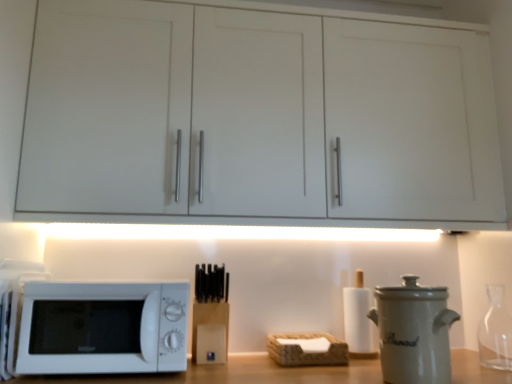
In order to click on white matte cabinet at upper center in this screenshot , I will do `click(13, 92)`.

What do you see at coordinates (13, 92) in the screenshot? This screenshot has width=512, height=384. I see `white matte cabinet at upper center` at bounding box center [13, 92].

Where is `brown woven basket at center`? This screenshot has height=384, width=512. brown woven basket at center is located at coordinates (304, 352).

Where is `white matte paper towel at center-right, acting as the second bottle starting from the right`? The height and width of the screenshot is (384, 512). white matte paper towel at center-right, acting as the second bottle starting from the right is located at coordinates (358, 319).

This screenshot has width=512, height=384. Describe the element at coordinates (103, 328) in the screenshot. I see `white matte microwave at lower left` at that location.

At what (x,y) coordinates should I click in order to perform the action: click on white matte cabinet at upper center. Please return your answer as a coordinate pair (x, y). The height and width of the screenshot is (384, 512). Looking at the image, I should click on (13, 92).

Is white matte paper towel at center-right, the second bottle in the front-to-back sequence, with brown woven basket at center?

No, white matte paper towel at center-right, the second bottle in the front-to-back sequence, is not making contact with brown woven basket at center.

Considering the relative positions of white matte paper towel at center-right, acting as the first bottle starting from the left, and brown woven basket at center in the image provided, is white matte paper towel at center-right, acting as the first bottle starting from the left, to the left or to the right of brown woven basket at center?

Clearly, white matte paper towel at center-right, acting as the first bottle starting from the left, is on the right of brown woven basket at center in the image.

Considering the sizes of objects white matte paper towel at center-right, acting as the first bottle starting from the left, and brown woven basket at center in the image provided, who is taller, white matte paper towel at center-right, acting as the first bottle starting from the left, or brown woven basket at center?

white matte paper towel at center-right, acting as the first bottle starting from the left, is taller.

Can you tell me how much white matte paper towel at center-right, acting as the second bottle starting from the right, and brown woven basket at center differ in facing direction?

The angle between the facing direction of white matte paper towel at center-right, acting as the second bottle starting from the right, and the facing direction of brown woven basket at center is 0.000762 degrees.

Based on the photo, considering the relative sizes of white matte cabinet at upper center and white matte microwave at lower left in the image provided, is white matte cabinet at upper center taller than white matte microwave at lower left?

Correct, white matte cabinet at upper center is much taller as white matte microwave at lower left.

From a real-world perspective, who is located higher, white matte cabinet at upper center or white matte microwave at lower left?

white matte cabinet at upper center is physically above.

The image size is (512, 384). I want to click on cabinetry above the white matte microwave at lower left (from a real-world perspective), so click(x=13, y=92).

Looking at this image, considering the sizes of objects white matte cabinet at upper center and white matte microwave at lower left in the image provided, who is thinner, white matte cabinet at upper center or white matte microwave at lower left?

Thinner between the two is white matte cabinet at upper center.

Is there a large distance between white matte cabinet at upper center and white ceramic bread bin at right?

Yes.

Is white matte cabinet at upper center aimed at white ceramic bread bin at right?

No, white matte cabinet at upper center is not oriented towards white ceramic bread bin at right.

From a real-world perspective, who is located higher, white matte cabinet at upper center or white ceramic bread bin at right?

white matte cabinet at upper center.

Considering the sizes of objects white matte cabinet at upper center and white ceramic bread bin at right in the image provided, who is taller, white matte cabinet at upper center or white ceramic bread bin at right?

Standing taller between the two is white matte cabinet at upper center.

From the image's perspective, is white matte paper towel at center-right, the second bottle in the front-to-back sequence, above or below white ceramic bread bin at right?

white matte paper towel at center-right, the second bottle in the front-to-back sequence, is situated lower than white ceramic bread bin at right in the image.

In the scene shown: Is white matte paper towel at center-right, positioned as the first bottle in back-to-front order, at the left side of white ceramic bread bin at right?

Yes, white matte paper towel at center-right, positioned as the first bottle in back-to-front order, is to the left of white ceramic bread bin at right.

Considering the points (356, 295) and (430, 341), which point is in front, point (356, 295) or point (430, 341)?

The point (430, 341) is in front.

Is white ceramic bread bin at right positioned before transparent glass bottle at right, placed as the 1th bottle when sorted from front to back?

Yes, white ceramic bread bin at right is closer to the camera.

Consider the image. From a real-world perspective, is white ceramic bread bin at right positioned over transparent glass bottle at right, which ranks as the 2th bottle in back-to-front order, based on gravity?

Actually, white ceramic bread bin at right is physically below transparent glass bottle at right, which ranks as the 2th bottle in back-to-front order, in the real world.

Which point is more distant from viewer, (447,332) or (492,364)?

Point (492,364)

Does white ceramic bread bin at right touch transparent glass bottle at right, placed as the 1th bottle when sorted from front to back?

No, white ceramic bread bin at right is not making contact with transparent glass bottle at right, placed as the 1th bottle when sorted from front to back.

Is point (362, 356) less distant than point (48, 359)?

No, (362, 356) is further to viewer.

Measure the distance between white matte paper towel at center-right, the second bottle in the front-to-back sequence, and white matte microwave at lower left.

white matte paper towel at center-right, the second bottle in the front-to-back sequence, and white matte microwave at lower left are 31.41 inches apart.

Which of these two, white matte paper towel at center-right, positioned as the first bottle in back-to-front order, or white matte microwave at lower left, is thinner?

white matte paper towel at center-right, positioned as the first bottle in back-to-front order.

Looking at this image, is white matte paper towel at center-right, the second bottle in the front-to-back sequence, not near white matte microwave at lower left?

No, white matte paper towel at center-right, the second bottle in the front-to-back sequence, is in close proximity to white matte microwave at lower left.

Image resolution: width=512 pixels, height=384 pixels. What are the coordinates of `bottle that is the 2nd object above the white matte microwave at lower left (from a real-world perspective)` in the screenshot? It's located at (495, 332).

Which of these two, transparent glass bottle at right, arranged as the second bottle when viewed from the left, or white matte microwave at lower left, stands shorter?

With less height is white matte microwave at lower left.

Is transparent glass bottle at right, acting as the 1th bottle starting from the right, far from white matte microwave at lower left?

Indeed, transparent glass bottle at right, acting as the 1th bottle starting from the right, is not near white matte microwave at lower left.

Between transparent glass bottle at right, which ranks as the 2th bottle in back-to-front order, and white matte microwave at lower left, which one is positioned behind?

transparent glass bottle at right, which ranks as the 2th bottle in back-to-front order.

From a real-world perspective, which bottle is the 1st one above the brown woven basket at center? Please provide its 2D coordinates.

[(358, 319)]

At what (x,y) coordinates should I click in order to perform the action: click on microwave oven below the white matte cabinet at upper center (from the image's perspective). Please return your answer as a coordinate pair (x, y). The image size is (512, 384). Looking at the image, I should click on pos(103,328).

Considering their positions, is transparent glass bottle at right, which ranks as the 2th bottle in back-to-front order, positioned further to white matte cabinet at upper center than brown woven basket at center?

transparent glass bottle at right, which ranks as the 2th bottle in back-to-front order, is further to white matte cabinet at upper center.

When comparing their distances from white matte microwave at lower left, does white matte paper towel at center-right, acting as the first bottle starting from the left, or white matte cabinet at upper center seem further?

Among the two, white matte paper towel at center-right, acting as the first bottle starting from the left, is located further to white matte microwave at lower left.

In the scene shown: When comparing their distances from transparent glass bottle at right, which ranks as the 2th bottle in back-to-front order, does white matte microwave at lower left or white matte cabinet at upper center seem further?

Based on the image, white matte cabinet at upper center appears to be further to transparent glass bottle at right, which ranks as the 2th bottle in back-to-front order.

When comparing their distances from white matte paper towel at center-right, positioned as the first bottle in back-to-front order, does white matte cabinet at upper center or brown woven basket at center seem closer?

brown woven basket at center lies closer to white matte paper towel at center-right, positioned as the first bottle in back-to-front order, than the other object.

Considering their positions, is brown woven basket at center positioned further to white matte paper towel at center-right, the second bottle in the front-to-back sequence, than white matte microwave at lower left?

white matte microwave at lower left.

Estimate the real-world distances between objects in this image. Which object is closer to white matte cabinet at upper center, white matte microwave at lower left or white matte paper towel at center-right, acting as the first bottle starting from the left?

Among the two, white matte microwave at lower left is located nearer to white matte cabinet at upper center.

Based on their spatial positions, is white matte microwave at lower left or white ceramic bread bin at right further from transparent glass bottle at right, acting as the 1th bottle starting from the right?

white matte microwave at lower left is positioned further to the anchor transparent glass bottle at right, acting as the 1th bottle starting from the right.

When comparing their distances from transparent glass bottle at right, acting as the 1th bottle starting from the right, does white matte paper towel at center-right, acting as the first bottle starting from the left, or brown woven basket at center seem further?

Based on the image, brown woven basket at center appears to be further to transparent glass bottle at right, acting as the 1th bottle starting from the right.

This screenshot has height=384, width=512. I want to click on basket between white matte microwave at lower left and transparent glass bottle at right, arranged as the second bottle when viewed from the left, from left to right, so pos(304,352).

Find the location of a particular element. The image size is (512, 384). cabinetry between white matte microwave at lower left and transparent glass bottle at right, placed as the 1th bottle when sorted from front to back is located at coordinates (13, 92).

I want to click on bottle between white matte microwave at lower left and transparent glass bottle at right, which ranks as the 2th bottle in back-to-front order, in the horizontal direction, so click(358, 319).

You are a GUI agent. You are given a task and a screenshot of the screen. Output one action in this format:
    pyautogui.click(x=<x>, y=<y>)
    Task: Click on the cabinetry between white matte microwave at lower left and white ceramic bread bin at right from left to right
    The image size is (512, 384).
    Given the screenshot: What is the action you would take?
    pyautogui.click(x=13, y=92)